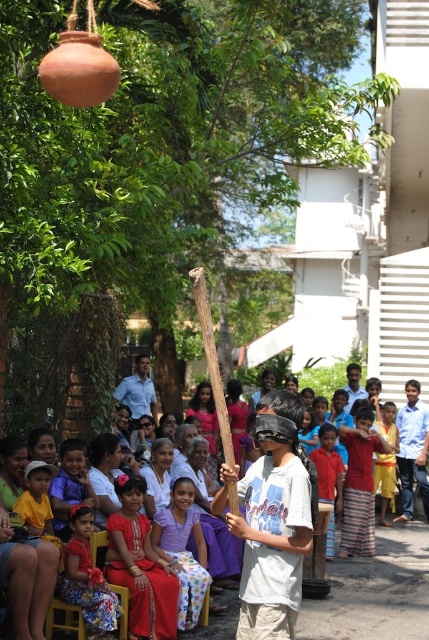
You are at an outdoor event and see two people dressed in a red striped skirt at center and a light blue shirt at center. Which one is more to the left?

The red striped skirt at center is more to the left side of the light blue shirt at center.

You are organizing a group photo and need to arrange the red cotton shirt at center and blue shirt at center based on their sizes. Which shirt should you place in the front row to ensure visibility?

The red cotton shirt at center should be placed in the front row because it is smaller than the blue shirt at center, allowing it to be seen without being obscured by the larger one.

You are a photographer positioned at the center of the scene. You want to take a photo that includes both the red striped skirt at center and the light blue shirt at center. Given that your camera has a maximum focus range of 10 meters, will both subjects be in focus?

The red striped skirt at center and light blue shirt at center are 9.90 meters apart from each other. Since the distance between them is less than the camera maximum focus range of 10 meters, both subjects will be in focus.